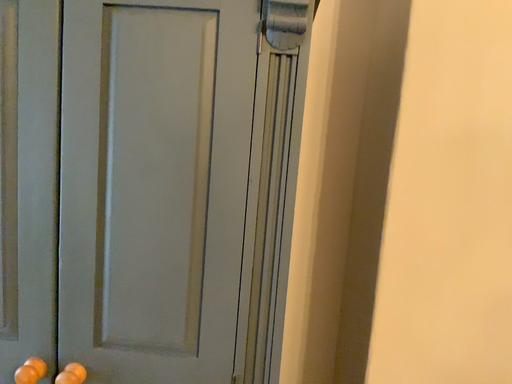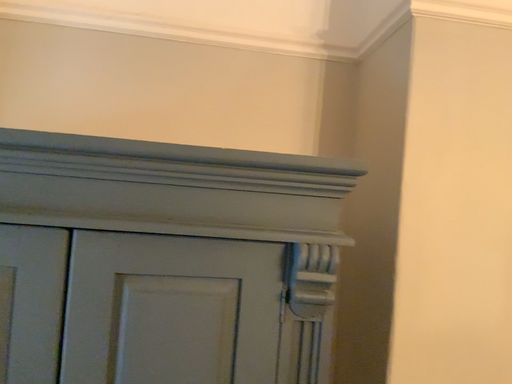
Question: How did the camera likely rotate when shooting the video?

Choices:
 (A) rotated right
 (B) rotated left

Answer: (A)